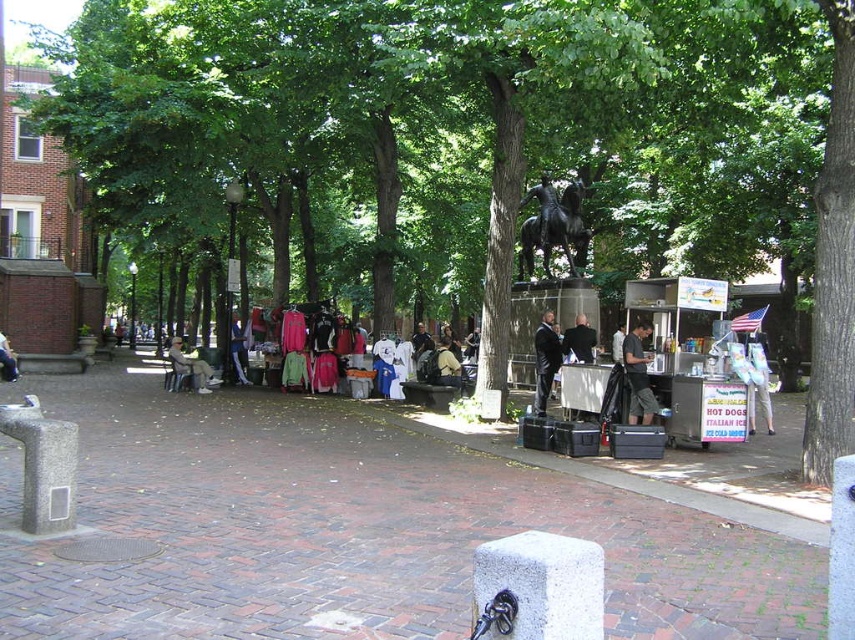
You are standing in the public square and want to take a photo of both the point at (576, 253) and the point at (572, 348). Which point should you focus on first to ensure both are in sharp focus?

You should focus on the point at (576, 253) first because it is closer to the camera than the point at (572, 348), ensuring both will be in focus when using proper focus settings.

Based on the photo, you are standing at the entrance of the square and want to find the dark suit at center. According to the coordinates provided, in which direction should you walk to reach it?

The dark suit at center is located at coordinates point (545, 360). Since you are at the entrance, which is likely at the edge of the scene, you should walk towards the center of the square to reach the dark suit at center.